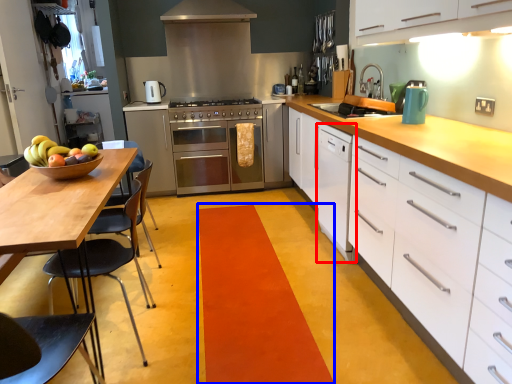
Question: Which point is further to the camera, file cabinet (highlighted by a red box) or plain (highlighted by a blue box)?

Choices:
 (A) file cabinet
 (B) plain

Answer: (A)